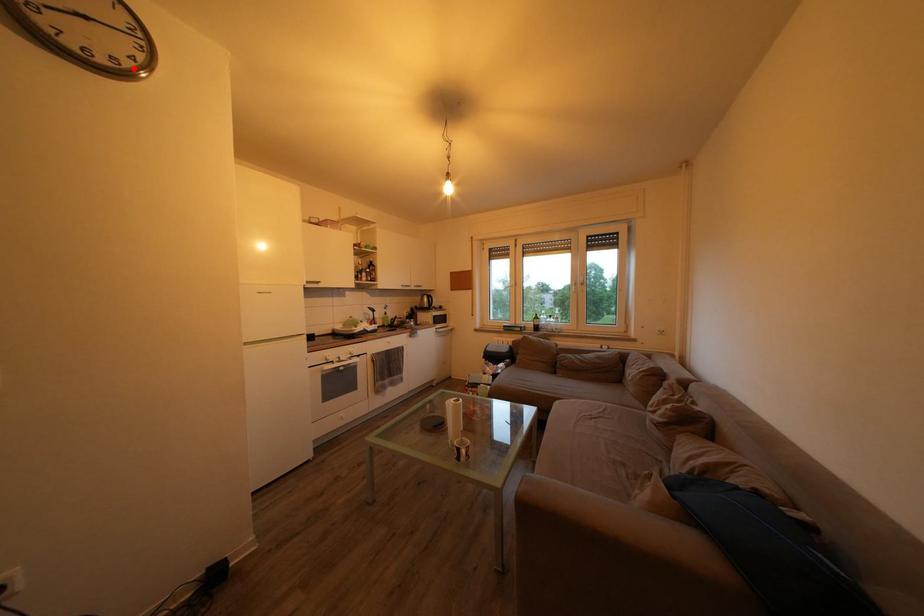
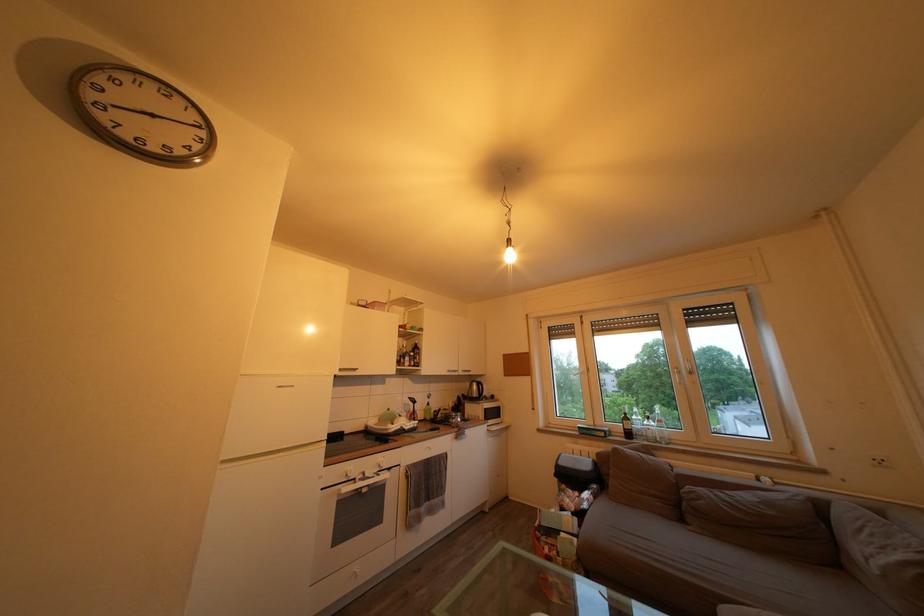
The point at the highlighted location is marked in the first image. Where is the corresponding point in the second image?

(188, 158)